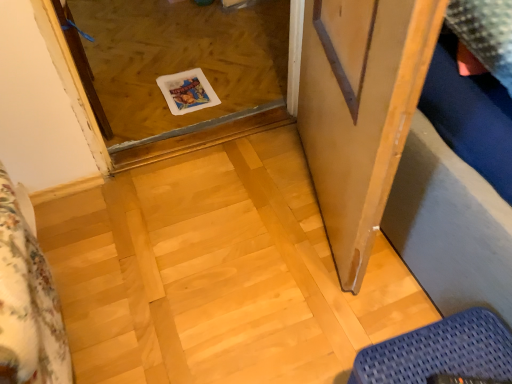
Question: Would you say transparent glass door at center is outside blue woven mat at lower right?

Choices:
 (A) yes
 (B) no

Answer: (A)

Question: Is transparent glass door at center oriented towards blue woven mat at lower right?

Choices:
 (A) yes
 (B) no

Answer: (B)

Question: Considering the relative sizes of transparent glass door at center and blue woven mat at lower right in the image provided, is transparent glass door at center shorter than blue woven mat at lower right?

Choices:
 (A) yes
 (B) no

Answer: (A)

Question: Are transparent glass door at center and blue woven mat at lower right located far from each other?

Choices:
 (A) no
 (B) yes

Answer: (B)

Question: Is transparent glass door at center taller than blue woven mat at lower right?

Choices:
 (A) yes
 (B) no

Answer: (B)

Question: Is point (124, 107) closer or farther from the camera than point (360, 29)?

Choices:
 (A) closer
 (B) farther

Answer: (B)

Question: Based on their sizes in the image, would you say transparent glass door at center is bigger or smaller than wooden screen door at right?

Choices:
 (A) small
 (B) big

Answer: (A)

Question: Is transparent glass door at center taller or shorter than wooden screen door at right?

Choices:
 (A) tall
 (B) short

Answer: (B)

Question: From the image's perspective, is transparent glass door at center above or below wooden screen door at right?

Choices:
 (A) below
 (B) above

Answer: (B)

Question: From a real-world perspective, is transparent glass door at center above or below blue woven mat at lower right?

Choices:
 (A) below
 (B) above

Answer: (A)

Question: Is transparent glass door at center situated inside blue woven mat at lower right or outside?

Choices:
 (A) outside
 (B) inside

Answer: (A)

Question: Considering the positions of transparent glass door at center and blue woven mat at lower right in the image, is transparent glass door at center wider or thinner than blue woven mat at lower right?

Choices:
 (A) thin
 (B) wide

Answer: (B)

Question: Considering the positions of point (106, 142) and point (501, 367), is point (106, 142) closer or farther from the camera than point (501, 367)?

Choices:
 (A) closer
 (B) farther

Answer: (B)

Question: Is blue woven mat at lower right situated inside wooden screen door at right or outside?

Choices:
 (A) inside
 (B) outside

Answer: (B)

Question: Considering the relative positions of blue woven mat at lower right and wooden screen door at right in the image provided, is blue woven mat at lower right to the left or to the right of wooden screen door at right?

Choices:
 (A) right
 (B) left

Answer: (A)